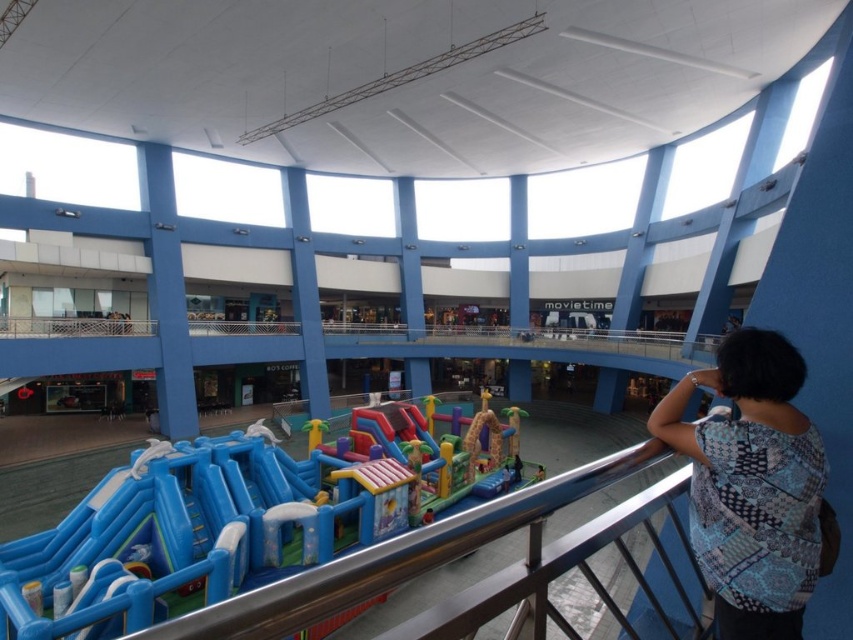
Does blue inflatable obstacle course at center have a larger size compared to blue printed blouse at upper right?

Correct, blue inflatable obstacle course at center is larger in size than blue printed blouse at upper right.

Is the position of blue inflatable obstacle course at center more distant than that of blue printed blouse at upper right?

That is True.

Where is `blue inflatable obstacle course at center`? Image resolution: width=853 pixels, height=640 pixels. blue inflatable obstacle course at center is located at coordinates (225, 522).